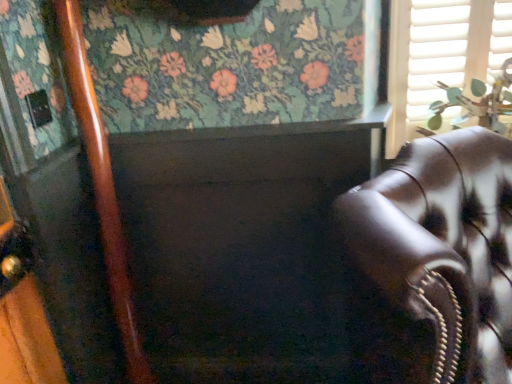
Question: Is white matte shutter at upper right looking in the opposite direction of green leafy plant at upper right?

Choices:
 (A) no
 (B) yes

Answer: (B)

Question: Can you confirm if white matte shutter at upper right is bigger than green leafy plant at upper right?

Choices:
 (A) no
 (B) yes

Answer: (A)

Question: Considering the relative sizes of white matte shutter at upper right and green leafy plant at upper right in the image provided, is white matte shutter at upper right wider than green leafy plant at upper right?

Choices:
 (A) no
 (B) yes

Answer: (A)

Question: From the image's perspective, would you say white matte shutter at upper right is positioned over green leafy plant at upper right?

Choices:
 (A) yes
 (B) no

Answer: (A)

Question: From a real-world perspective, is white matte shutter at upper right located higher than green leafy plant at upper right?

Choices:
 (A) yes
 (B) no

Answer: (A)

Question: Considering the positions of green leafy plant at upper right and white matte shutter at upper right in the image, is green leafy plant at upper right bigger or smaller than white matte shutter at upper right?

Choices:
 (A) small
 (B) big

Answer: (B)

Question: Is green leafy plant at upper right in front of or behind white matte shutter at upper right in the image?

Choices:
 (A) behind
 (B) front

Answer: (B)

Question: From a real-world perspective, is green leafy plant at upper right above or below white matte shutter at upper right?

Choices:
 (A) below
 (B) above

Answer: (A)

Question: Considering the positions of point (472, 114) and point (437, 66), is point (472, 114) closer or farther from the camera than point (437, 66)?

Choices:
 (A) farther
 (B) closer

Answer: (A)

Question: From a real-world perspective, relative to green leafy plant at upper right, is leather couch at right vertically above or below?

Choices:
 (A) above
 (B) below

Answer: (B)

Question: Is point (501, 339) positioned closer to the camera than point (486, 102)?

Choices:
 (A) closer
 (B) farther

Answer: (A)

Question: Is leather couch at right wider or thinner than green leafy plant at upper right?

Choices:
 (A) thin
 (B) wide

Answer: (B)

Question: Considering their positions, is leather couch at right located in front of or behind green leafy plant at upper right?

Choices:
 (A) front
 (B) behind

Answer: (A)

Question: Considering the positions of white matte shutter at upper right and leather couch at right in the image, is white matte shutter at upper right taller or shorter than leather couch at right?

Choices:
 (A) short
 (B) tall

Answer: (A)

Question: Relative to leather couch at right, is white matte shutter at upper right in front or behind?

Choices:
 (A) front
 (B) behind

Answer: (B)